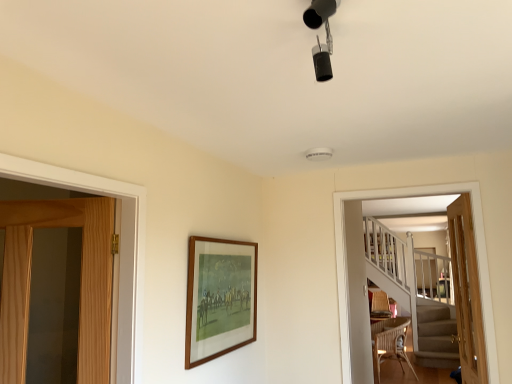
Question: Is the position of wicker armchair at lower right less distant than that of wooden frame at center?

Choices:
 (A) no
 (B) yes

Answer: (A)

Question: Does wicker armchair at lower right appear on the right side of wooden frame at center?

Choices:
 (A) no
 (B) yes

Answer: (B)

Question: Considering the relative sizes of wicker armchair at lower right and wooden frame at center in the image provided, is wicker armchair at lower right thinner than wooden frame at center?

Choices:
 (A) no
 (B) yes

Answer: (A)

Question: From the image's perspective, is wicker armchair at lower right on top of wooden frame at center?

Choices:
 (A) yes
 (B) no

Answer: (B)

Question: Does wicker armchair at lower right have a greater height compared to wooden frame at center?

Choices:
 (A) yes
 (B) no

Answer: (A)

Question: Considering the positions of light wood door at right, the 2th door viewed from the left, and wicker armchair at lower right in the image, is light wood door at right, the 2th door viewed from the left, wider or thinner than wicker armchair at lower right?

Choices:
 (A) wide
 (B) thin

Answer: (B)

Question: In terms of height, does light wood door at right, which is the first door in right-to-left order, look taller or shorter compared to wicker armchair at lower right?

Choices:
 (A) short
 (B) tall

Answer: (B)

Question: Considering the positions of light wood door at right, which is the first door in right-to-left order, and wicker armchair at lower right in the image, is light wood door at right, which is the first door in right-to-left order, bigger or smaller than wicker armchair at lower right?

Choices:
 (A) small
 (B) big

Answer: (A)

Question: Does point (466, 364) appear closer or farther from the camera than point (373, 304)?

Choices:
 (A) closer
 (B) farther

Answer: (A)

Question: From a real-world perspective, is light brown wooden door at left, which appears as the second door when viewed from the right, above or below woven brown chair at lower right?

Choices:
 (A) above
 (B) below

Answer: (A)

Question: Is light brown wooden door at left, which appears as the second door when viewed from the right, spatially inside woven brown chair at lower right, or outside of it?

Choices:
 (A) outside
 (B) inside

Answer: (A)

Question: From their relative heights in the image, would you say light brown wooden door at left, which appears as the second door when viewed from the right, is taller or shorter than woven brown chair at lower right?

Choices:
 (A) short
 (B) tall

Answer: (B)

Question: Is light brown wooden door at left, which is counted as the first door, starting from the left, in front of or behind woven brown chair at lower right in the image?

Choices:
 (A) behind
 (B) front

Answer: (B)

Question: Considering their positions, is woven brown chair at lower right located in front of or behind wooden screen door at right?

Choices:
 (A) front
 (B) behind

Answer: (B)

Question: In terms of height, does woven brown chair at lower right look taller or shorter compared to wooden screen door at right?

Choices:
 (A) short
 (B) tall

Answer: (A)